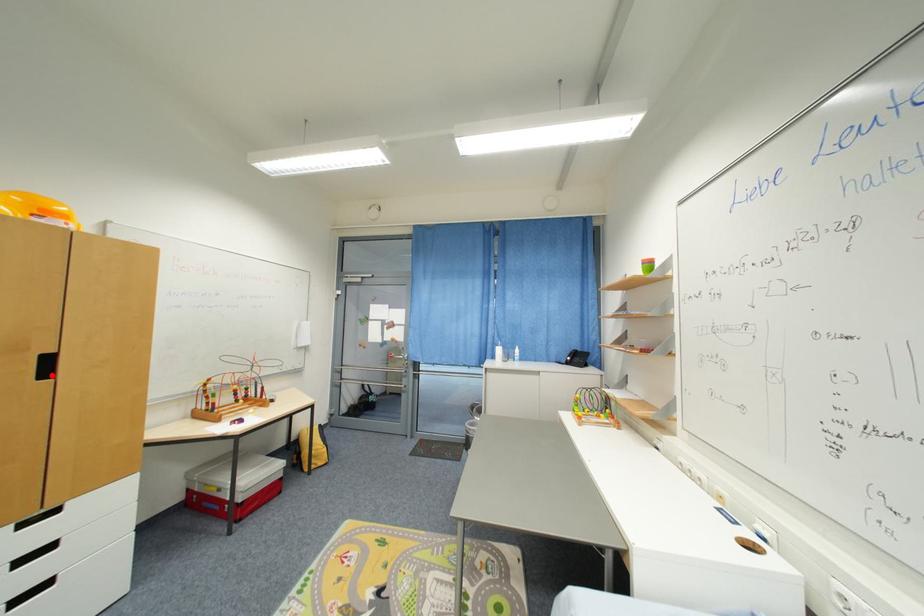
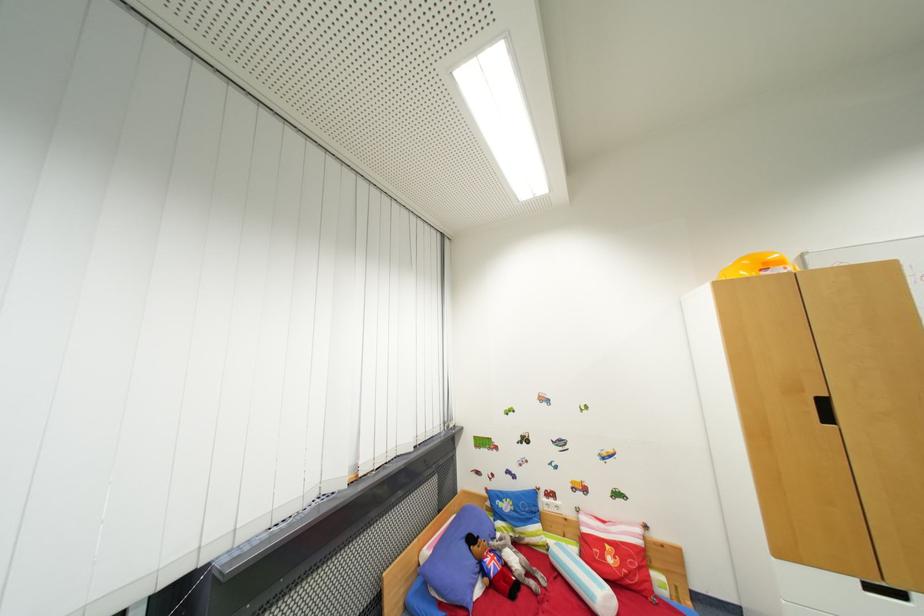
The point at the highlighted location is marked in the first image. Where is the corresponding point in the second image?

(833, 419)